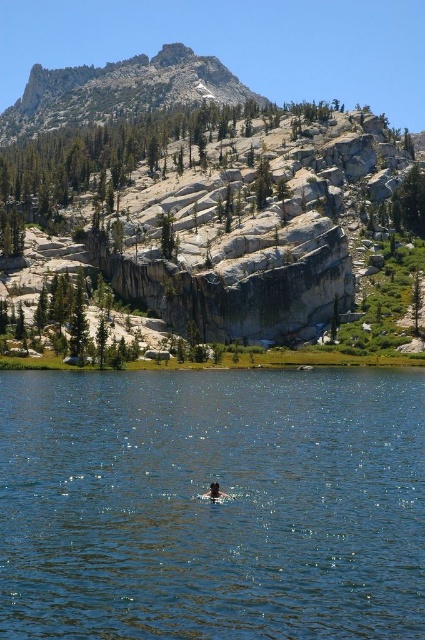
You are standing on the lakeshore and want to take a photo of both the blue water at center and the rugged granite peak at upper center. Which object should you point your camera towards first to ensure both are in the frame?

You should point your camera towards the rugged granite peak at upper center first because the blue water at center is below it, so by framing the peak, the water will naturally be included in the lower part of the photo.

You are standing at the origin point of the coordinate system. You want to reach the blue water at center. Which direction should you move in?

Since the blue water at center is located at coordinate point [212,504], you should move towards the right and slightly upwards from your current position to reach it.

Based on the photo, you are a hiker standing at the lakeside and looking towards the rugged granite peak at upper center and the brown hair at center. Which object appears taller from your perspective?

The rugged granite peak at upper center appears taller than the brown hair at center because it has a greater height compared to the brown hair at center.